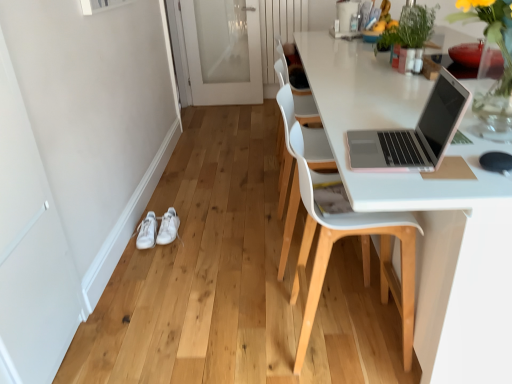
This screenshot has height=384, width=512. I want to click on vacant region under pink plastic laptop at upper right (from a real-world perspective), so click(x=394, y=150).